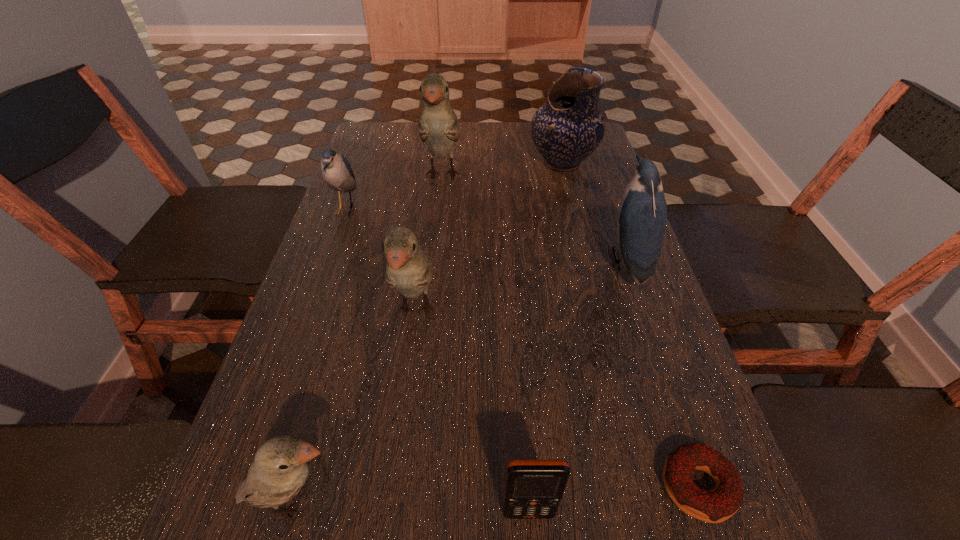
The image size is (960, 540). What are the coordinates of `the farthest white bird` in the screenshot? It's located at (438, 127).

Locate an element on the screen. The width and height of the screenshot is (960, 540). the tallest bird is located at coordinates (438, 127).

You are a GUI agent. You are given a task and a screenshot of the screen. Output one action in this format:
    pyautogui.click(x=<x>, y=<y>)
    Task: Click on the pottery
    
    Given the screenshot: What is the action you would take?
    [568, 128]

Image resolution: width=960 pixels, height=540 pixels. What are the coordinates of `the right blue bird` in the screenshot? It's located at (642, 213).

Find the location of a particular element. This screenshot has height=540, width=960. the nearer blue bird is located at coordinates (642, 213).

Locate an element on the screen. the second farthest white bird is located at coordinates (409, 269).

At what (x,y) coordinates should I click in order to perform the action: click on the farther blue bird. Please return your answer as a coordinate pair (x, y). The width and height of the screenshot is (960, 540). Looking at the image, I should click on (337, 172).

This screenshot has height=540, width=960. I want to click on the smaller blue bird, so click(337, 172).

Find the location of a particular element. the nearest white bird is located at coordinates (280, 468).

Identify the location of the leftmost white bird. This screenshot has height=540, width=960. (280, 468).